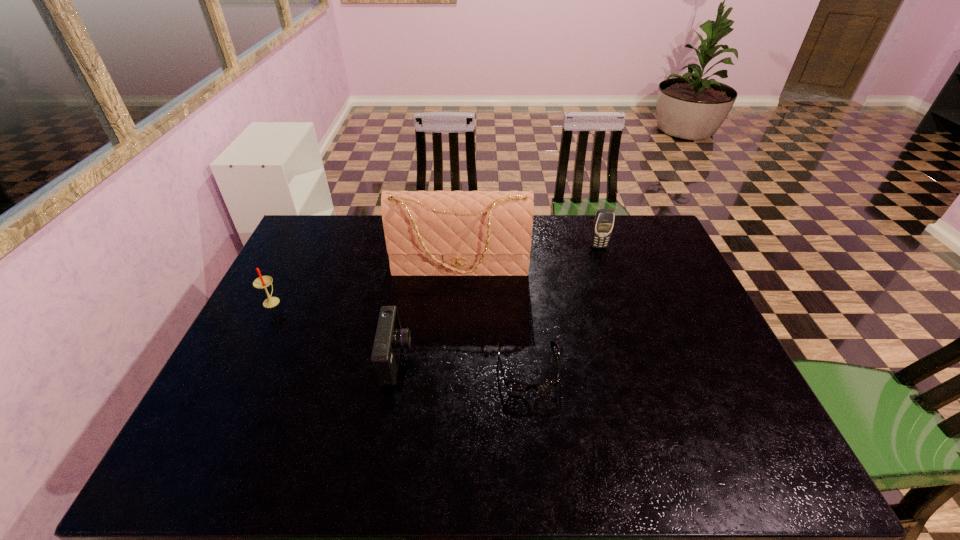
Locate an element on the screen. The image size is (960, 540). vacant position in the image that satisfies the following two spatial constraints: 1. on the front-facing side of the fourth nearest object; 2. on the front-facing side of the camera is located at coordinates (455, 360).

I want to click on vacant area that satisfies the following two spatial constraints: 1. on the front face of the rightmost object; 2. on the front-facing side of the camera, so click(636, 360).

Image resolution: width=960 pixels, height=540 pixels. In order to click on blank space that satisfies the following two spatial constraints: 1. on the front face of the cellular telephone; 2. on the front-facing side of the camera in this screenshot , I will do `click(636, 360)`.

This screenshot has width=960, height=540. Find the location of `vacant area in the image that satisfies the following two spatial constraints: 1. on the front face of the farthest object; 2. on the front-facing side of the camera`. vacant area in the image that satisfies the following two spatial constraints: 1. on the front face of the farthest object; 2. on the front-facing side of the camera is located at coordinates [x=636, y=360].